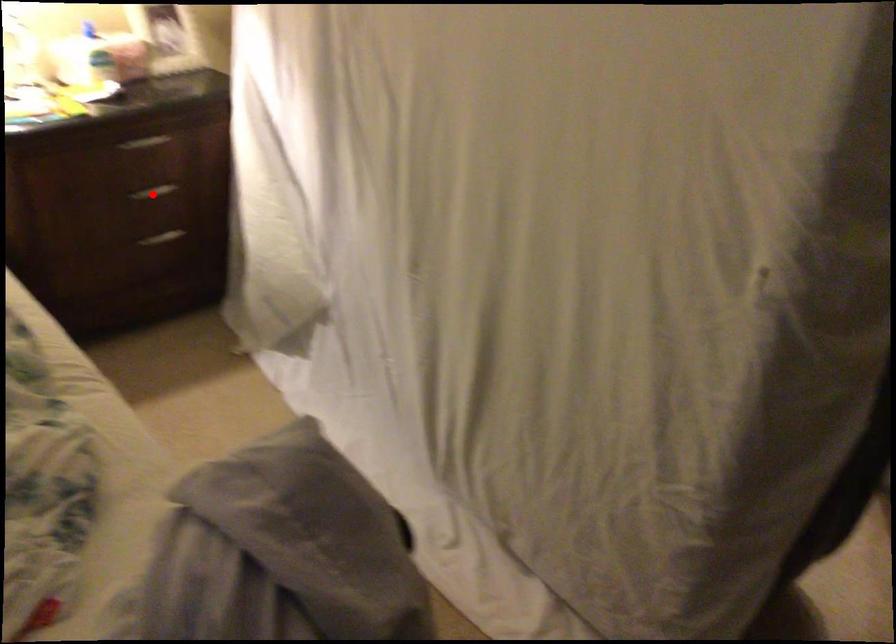
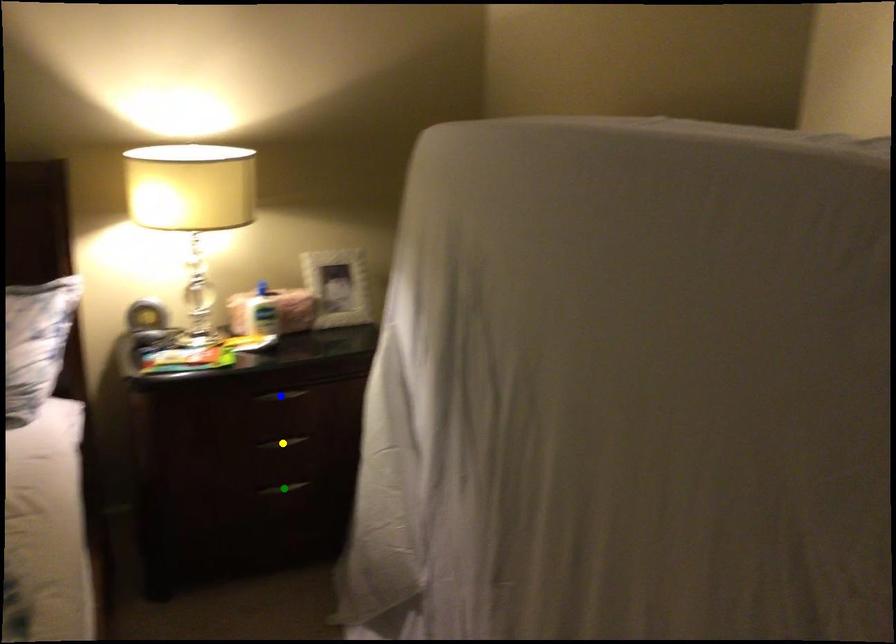
Question: I am providing you with two images of the same scene from different viewpoints. A red point is marked on the first image. You are given multiple points on the second image. Which point in image 2 is actually the same real-world point as the red point in image 1?

Choices:
 (A) yellow point
 (B) blue point
 (C) green point

Answer: (A)